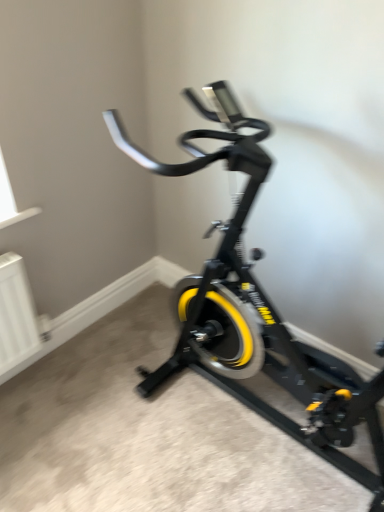
At what (x,y) coordinates should I click in order to perform the action: click on vacant space in yellow matte stationary bicycle at center (from a real-world perspective). Please return your answer as a coordinate pair (x, y). The width and height of the screenshot is (384, 512). Looking at the image, I should click on (265, 432).